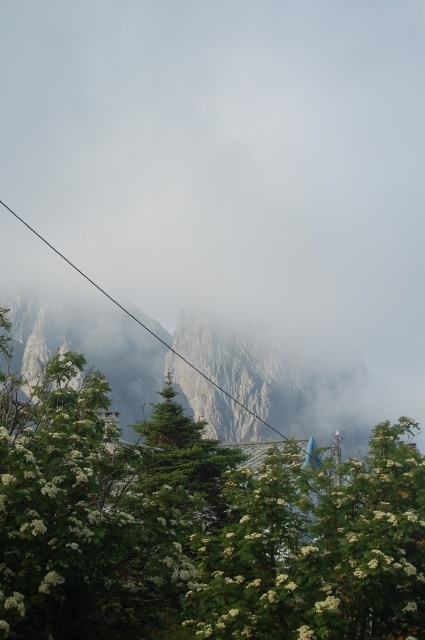
Looking at this image, you are a hiker planning to climb the mountain and need to set up a safety line between the green leafy tree at center and the black wire at upper center. The safety line you have can only stretch up to 100 meters. Based on the scene, will your safety line be sufficient?

The green leafy tree at center is 103.21 meters from the black wire at upper center, so the safety line that can only stretch up to 100 meters will not be sufficient.

You are an artist trying to paint this landscape. You want to ensure that the foggy misty mountain at upper center and the green leafy tree at center are proportionally accurate. Based on the scene, which object should you make wider in your painting?

The foggy misty mountain at upper center should be made wider in the painting since it might be wider than the green leafy tree at center according to the description.